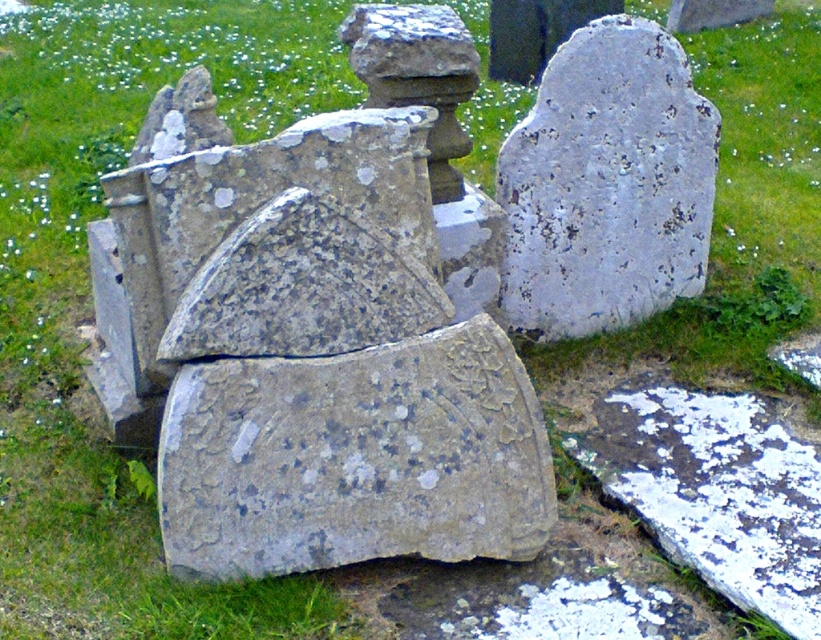
Does white stone at center appear over white speckled stone at lower right?

Indeed, white stone at center is positioned over white speckled stone at lower right.

Measure the distance between white stone at center and camera.

A distance of 3.38 meters exists between white stone at center and camera.

This screenshot has height=640, width=821. I want to click on white stone at center, so click(608, 184).

I want to click on white stone at center, so pos(608,184).